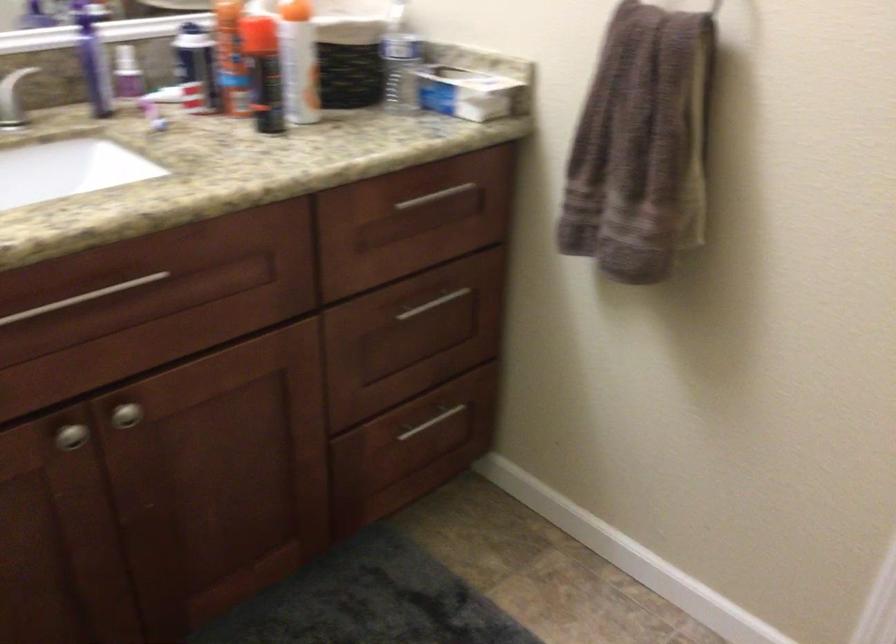
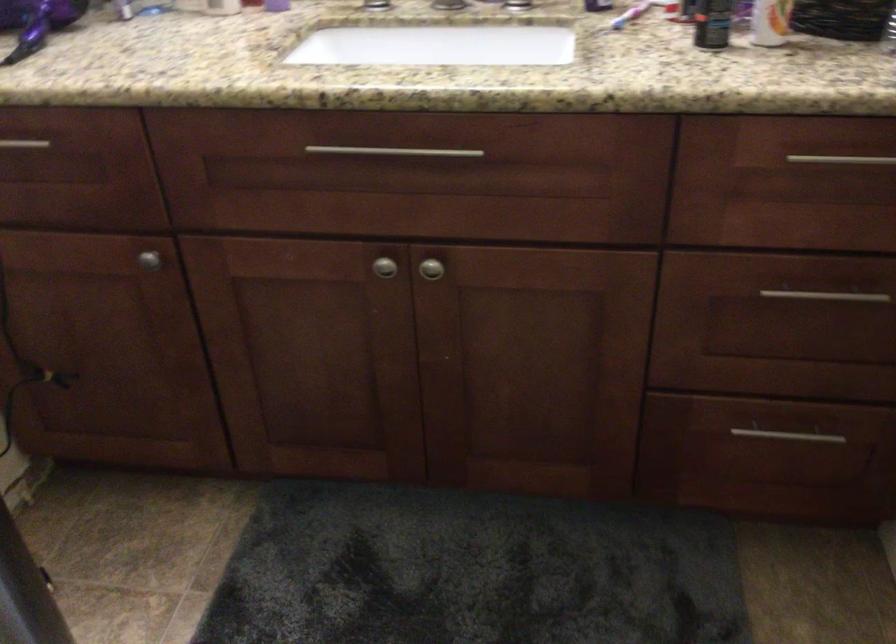
Where in the second image is the point corresponding to (425,198) from the first image?

(841, 158)